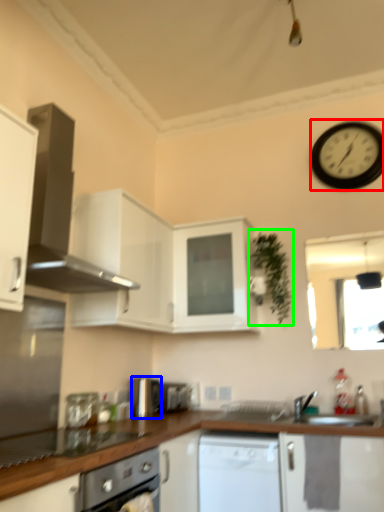
Question: Considering the real-world distances, which object is closest to wall clock (highlighted by a red box)? appliance (highlighted by a blue box) or plant (highlighted by a green box).

Choices:
 (A) appliance
 (B) plant

Answer: (B)